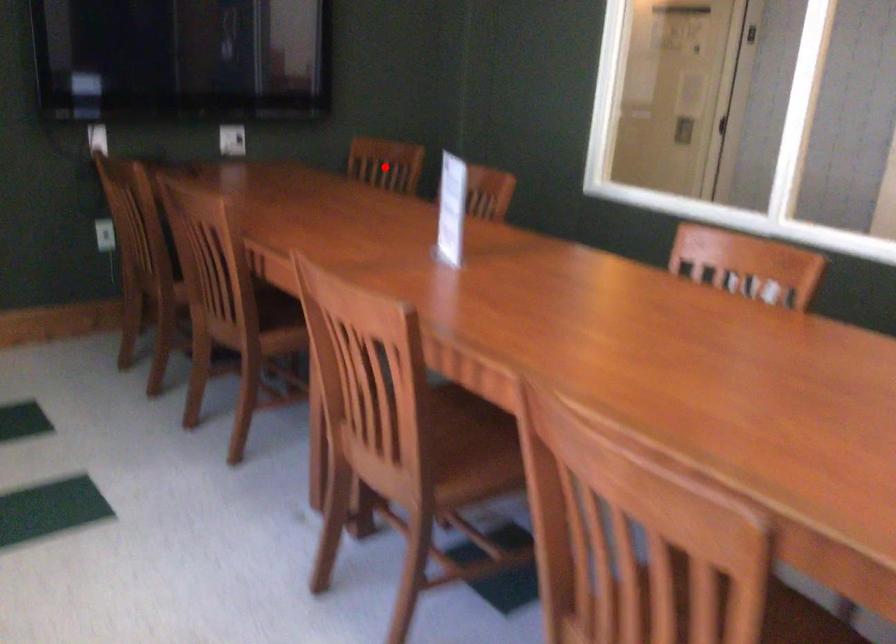
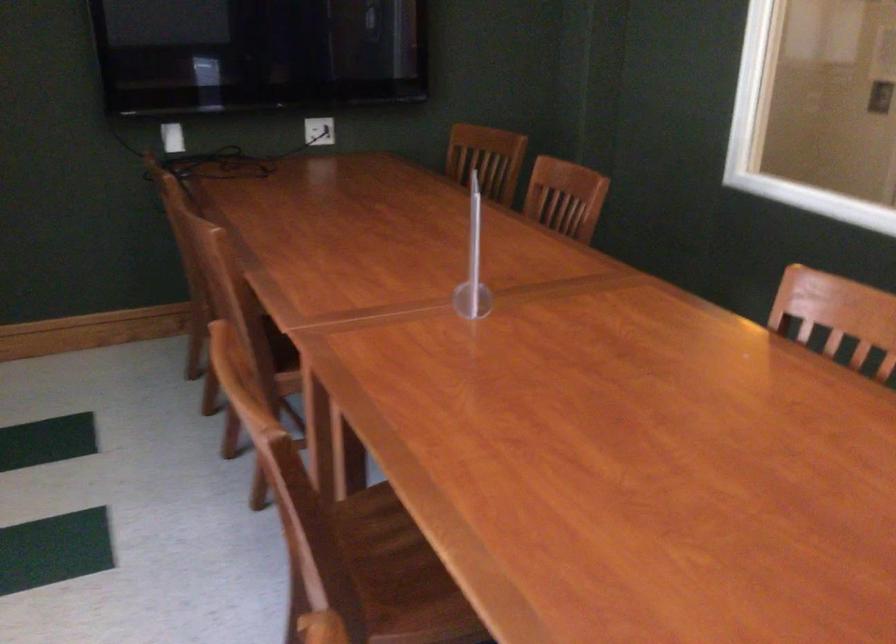
Question: I am providing you with two images of the same scene from different viewpoints. In image1, a red point is highlighted. Considering the same 3D point in image2, which of the following is correct?

Choices:
 (A) It is closer
 (B) It is farther

Answer: (A)